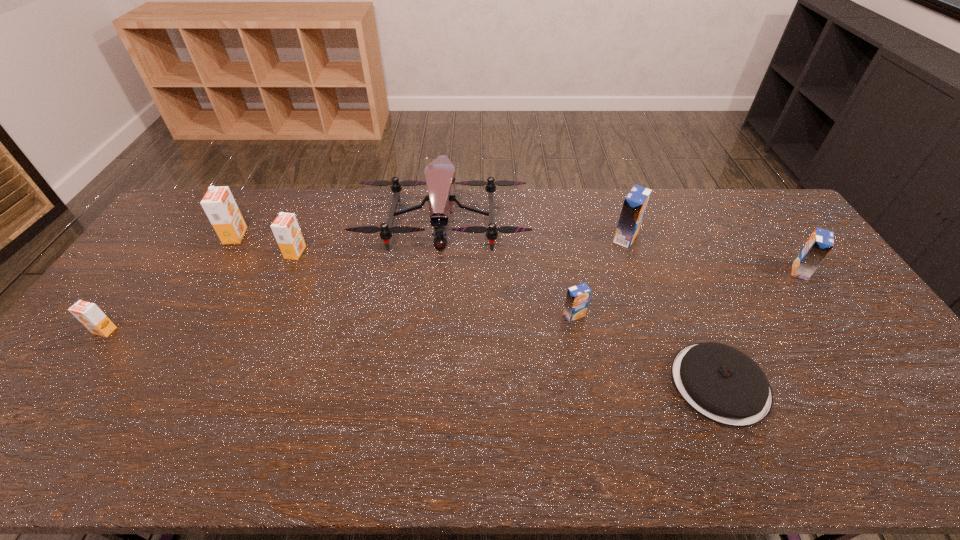
Image resolution: width=960 pixels, height=540 pixels. What are the coordinates of `the smallest blue orange_juice` in the screenshot? It's located at (577, 299).

In order to click on the nearest blue orange_juice in this screenshot , I will do `click(577, 299)`.

Where is `the nearest orange juice`? The height and width of the screenshot is (540, 960). the nearest orange juice is located at coordinates (89, 314).

Identify the location of the nearest orange orange juice. (89, 314).

Identify the location of the shortest object. (721, 383).

At what (x,y) coordinates should I click in order to perform the action: click on the nearest object. Please return your answer as a coordinate pair (x, y). Looking at the image, I should click on (721, 383).

Locate an element on the screen. The image size is (960, 540). free spot located on the front-facing side of the drone is located at coordinates (439, 270).

Identify the location of free spot located on the back of the biggest blue orange_juice. The width and height of the screenshot is (960, 540). (614, 207).

Locate an element on the screen. vacant space positioned 0.370m on the front of the second orange orange juice from right to left is located at coordinates (177, 335).

You are a GUI agent. You are given a task and a screenshot of the screen. Output one action in this format:
    pyautogui.click(x=<x>, y=<y>)
    Task: Click on the free region located on the back of the second biggest blue orange_juice
    The height and width of the screenshot is (540, 960).
    Given the screenshot: What is the action you would take?
    pyautogui.click(x=769, y=228)